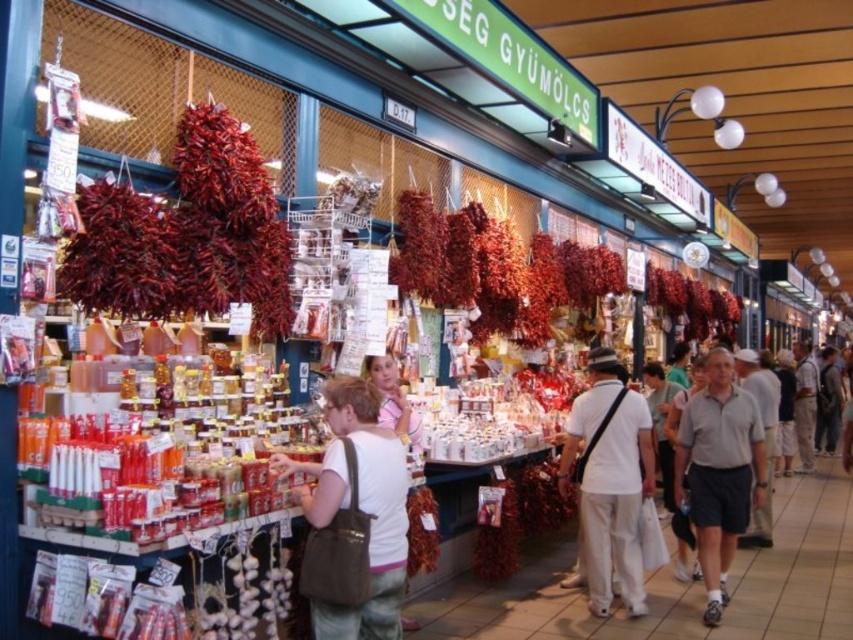
Does dried red pepper at left appear under white cotton shirt at center?

Actually, dried red pepper at left is above white cotton shirt at center.

Between point (151, 260) and point (622, 515), which one is positioned in front?

Point (151, 260) is in front.

This screenshot has height=640, width=853. What are the coordinates of `dried red pepper at left` in the screenshot? It's located at (187, 234).

At what (x,y) coordinates should I click in order to perform the action: click on dried red pepper at left. Please return your answer as a coordinate pair (x, y). This screenshot has height=640, width=853. Looking at the image, I should click on (187, 234).

Identify the location of dried red pepper at left. pos(187,234).

Does gray cotton shirt at center-right have a larger size compared to dried red pepper at center?

Indeed, gray cotton shirt at center-right has a larger size compared to dried red pepper at center.

Which of these two, gray cotton shirt at center-right or dried red pepper at center, stands shorter?

dried red pepper at center is shorter.

The width and height of the screenshot is (853, 640). Describe the element at coordinates (718, 472) in the screenshot. I see `gray cotton shirt at center-right` at that location.

You are a GUI agent. You are given a task and a screenshot of the screen. Output one action in this format:
    pyautogui.click(x=<x>, y=<y>)
    Task: Click on the gray cotton shirt at center-right
    This screenshot has height=640, width=853.
    Given the screenshot: What is the action you would take?
    pyautogui.click(x=718, y=472)